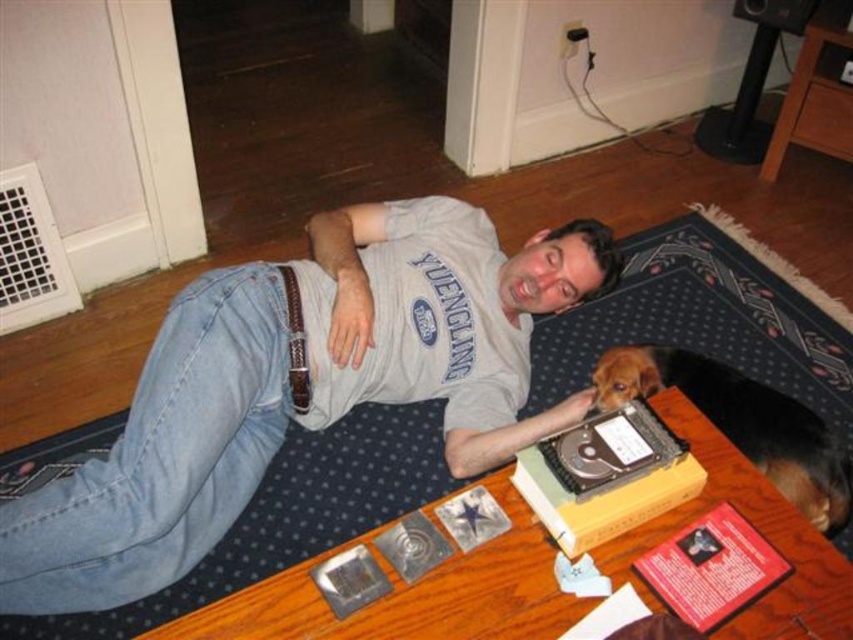
You are standing in the room and want to place a 5 feet long ladder in the space. The ladder must be placed such that it reaches the point at coordinates point [115,588] without hitting any objects. Is there enough space to place the ladder?

The distance of point [115,588] from viewer is 4.66 feet. Since the ladder is 5 feet long, it would extend beyond the required distance, potentially hitting objects or the wall. Therefore, there isn

You are taking a photo of the scene and want to focus on both the point at (332, 266) and the point at (782, 465). Which point should you adjust your camera focus to first to ensure both are in focus?

You should focus on the point at (332, 266) first because it is closer to the camera than the point at (782, 465). By focusing on the closer point, the farther point will also be within the depth of field.